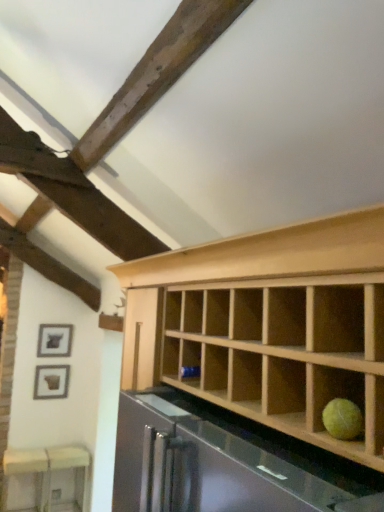
Question: Considering the relative positions of white glossy table at lower left and matte black picture frame at lower left, which ranks as the 1th picture frame in bottom-to-top order, in the image provided, is white glossy table at lower left to the right of matte black picture frame at lower left, which ranks as the 1th picture frame in bottom-to-top order, from the viewer's perspective?

Choices:
 (A) no
 (B) yes

Answer: (A)

Question: Is white glossy table at lower left facing towards matte black picture frame at lower left, the 2th picture frame when ordered from top to bottom?

Choices:
 (A) yes
 (B) no

Answer: (B)

Question: Can you confirm if white glossy table at lower left is smaller than matte black picture frame at lower left, the 2th picture frame when ordered from top to bottom?

Choices:
 (A) no
 (B) yes

Answer: (A)

Question: Is white glossy table at lower left oriented away from matte black picture frame at lower left, which ranks as the 1th picture frame in bottom-to-top order?

Choices:
 (A) no
 (B) yes

Answer: (A)

Question: Does white glossy table at lower left contain matte black picture frame at lower left, which ranks as the 1th picture frame in bottom-to-top order?

Choices:
 (A) no
 (B) yes

Answer: (A)

Question: Considering the relative positions of matte black picture frame at lower left, which ranks as the 1th picture frame in bottom-to-top order, and matte black picture frame at upper left, acting as the first picture frame starting from the top, in the image provided, is matte black picture frame at lower left, which ranks as the 1th picture frame in bottom-to-top order, to the left or to the right of matte black picture frame at upper left, acting as the first picture frame starting from the top,?

Choices:
 (A) right
 (B) left

Answer: (B)

Question: Considering their positions, is matte black picture frame at lower left, the 2th picture frame when ordered from top to bottom, located in front of or behind matte black picture frame at upper left, acting as the first picture frame starting from the top?

Choices:
 (A) front
 (B) behind

Answer: (A)

Question: From the image's perspective, is matte black picture frame at lower left, which ranks as the 1th picture frame in bottom-to-top order, above or below matte black picture frame at upper left, the second picture frame from the bottom?

Choices:
 (A) above
 (B) below

Answer: (B)

Question: Looking at the image, does matte black picture frame at lower left, the 2th picture frame when ordered from top to bottom, seem bigger or smaller compared to matte black picture frame at upper left, the second picture frame from the bottom?

Choices:
 (A) small
 (B) big

Answer: (A)

Question: From their relative heights in the image, would you say matte black picture frame at upper left, the second picture frame from the bottom, is taller or shorter than matte black picture frame at lower left, the 2th picture frame when ordered from top to bottom?

Choices:
 (A) short
 (B) tall

Answer: (A)

Question: Considering the relative positions of matte black picture frame at upper left, acting as the first picture frame starting from the top, and matte black picture frame at lower left, the 2th picture frame when ordered from top to bottom, in the image provided, is matte black picture frame at upper left, acting as the first picture frame starting from the top, to the left or to the right of matte black picture frame at lower left, the 2th picture frame when ordered from top to bottom,?

Choices:
 (A) right
 (B) left

Answer: (A)

Question: In terms of width, does matte black picture frame at upper left, acting as the first picture frame starting from the top, look wider or thinner when compared to matte black picture frame at lower left, the 2th picture frame when ordered from top to bottom?

Choices:
 (A) wide
 (B) thin

Answer: (B)

Question: From the image's perspective, is matte black picture frame at upper left, acting as the first picture frame starting from the top, above or below matte black picture frame at lower left, the 2th picture frame when ordered from top to bottom?

Choices:
 (A) below
 (B) above

Answer: (B)

Question: Is point (81, 449) positioned closer to the camera than point (66, 369)?

Choices:
 (A) closer
 (B) farther

Answer: (A)

Question: From the image's perspective, is white glossy table at lower left located above or below matte black picture frame at lower left, the 2th picture frame when ordered from top to bottom?

Choices:
 (A) above
 (B) below

Answer: (B)